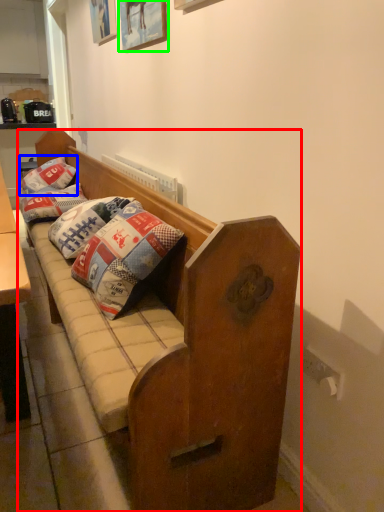
Question: Estimate the real-world distances between objects in this image. Which object is farther from studio couch (highlighted by a red box), pillow (highlighted by a blue box) or picture frame (highlighted by a green box)?

Choices:
 (A) pillow
 (B) picture frame

Answer: (A)